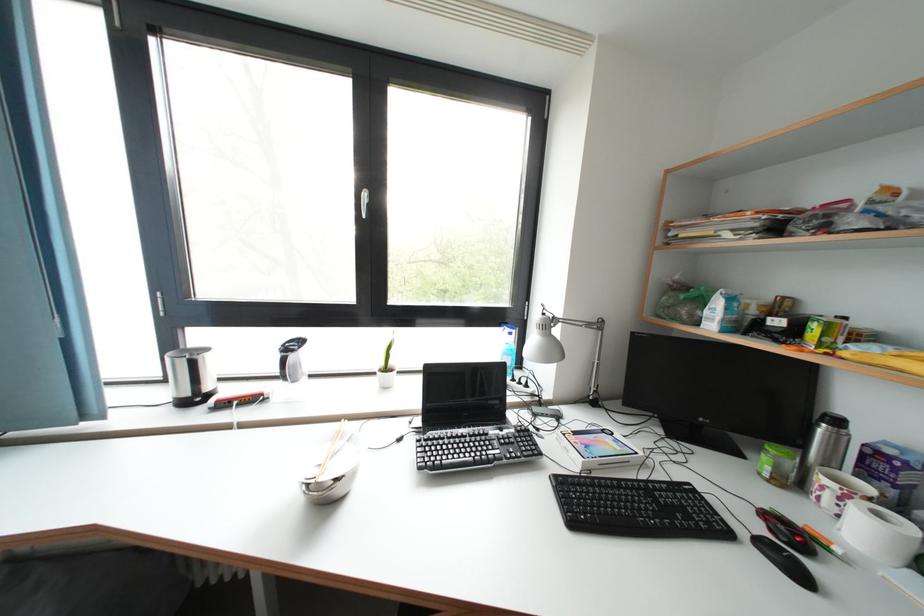
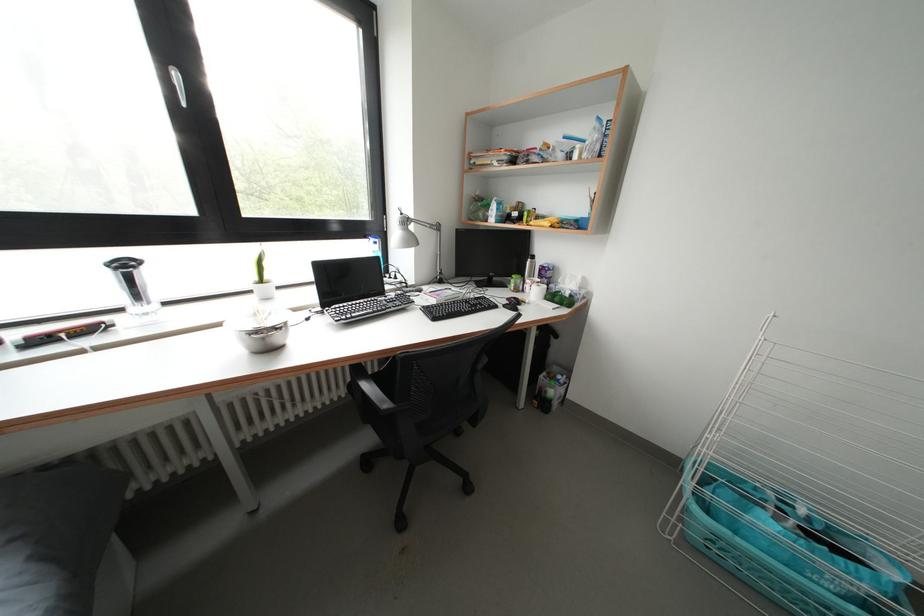
In the second image, find the point that corresponds to pixel 831 485 in the first image.

(535, 286)